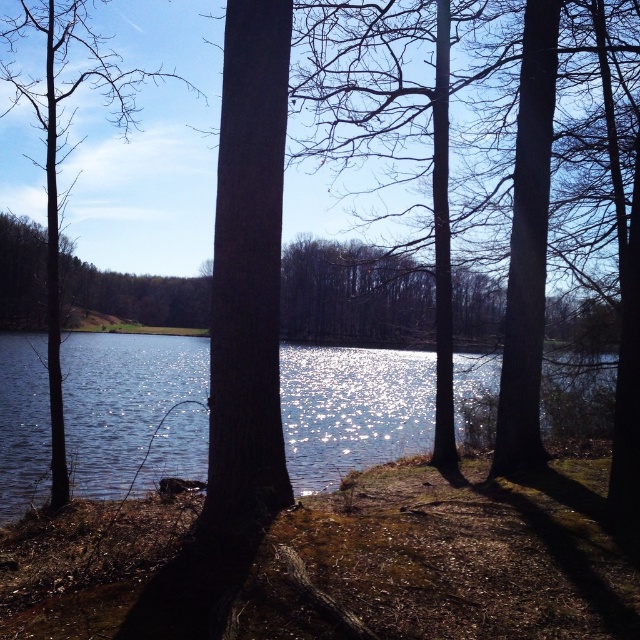
Question: Which of the following is the closest to the observer?

Choices:
 (A) glistening water at center
 (B) brown matte tree at left

Answer: (A)

Question: Does glistening water at center have a larger size compared to brown matte tree at left?

Choices:
 (A) no
 (B) yes

Answer: (A)

Question: Does glistening water at center have a larger size compared to brown matte tree at left?

Choices:
 (A) yes
 (B) no

Answer: (B)

Question: Is glistening water at center positioned at the back of brown matte tree at left?

Choices:
 (A) yes
 (B) no

Answer: (B)

Question: Which of the following is the closest to the observer?

Choices:
 (A) glistening water at center
 (B) brown matte tree at left

Answer: (A)

Question: Which point is farther from the camera taking this photo?

Choices:
 (A) (381, 413)
 (B) (60, 452)

Answer: (A)